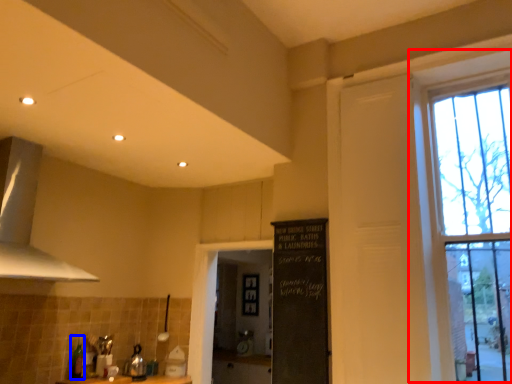
Question: Which of the following is the closest to the observer, window (highlighted by a red box) or bottle (highlighted by a blue box)?

Choices:
 (A) window
 (B) bottle

Answer: (A)